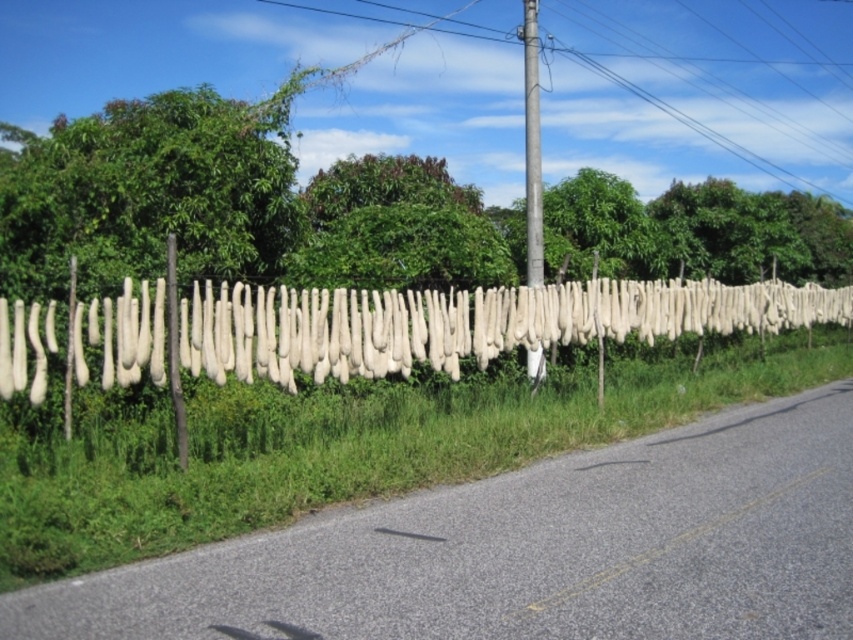
Question: Which point appears closest to the camera in this image?

Choices:
 (A) pos(450,323)
 (B) pos(759,502)

Answer: (B)

Question: Which point is closer to the camera?

Choices:
 (A) metallic gray pole at center
 (B) yellow asphalt road at center

Answer: (B)

Question: Which point is farther to the camera?

Choices:
 (A) (508, 616)
 (B) (183, 433)

Answer: (B)

Question: Can you confirm if metallic gray pole at center is thinner than yellow asphalt road at center?

Choices:
 (A) yes
 (B) no

Answer: (B)

Question: Is white fabric at center below yellow asphalt road at center?

Choices:
 (A) no
 (B) yes

Answer: (A)

Question: Is white fabric at center thinner than metallic gray pole at center?

Choices:
 (A) no
 (B) yes

Answer: (A)